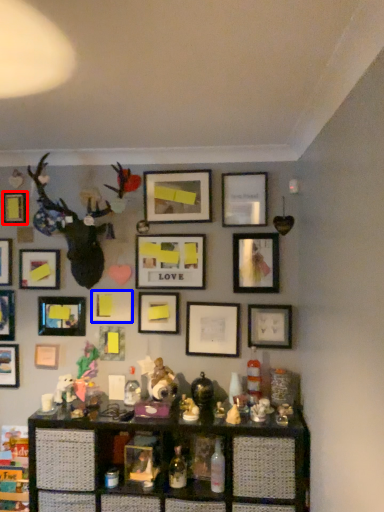
Question: Which object is closer to the camera taking this photo, picture frame (highlighted by a red box) or picture frame (highlighted by a blue box)?

Choices:
 (A) picture frame
 (B) picture frame

Answer: (B)